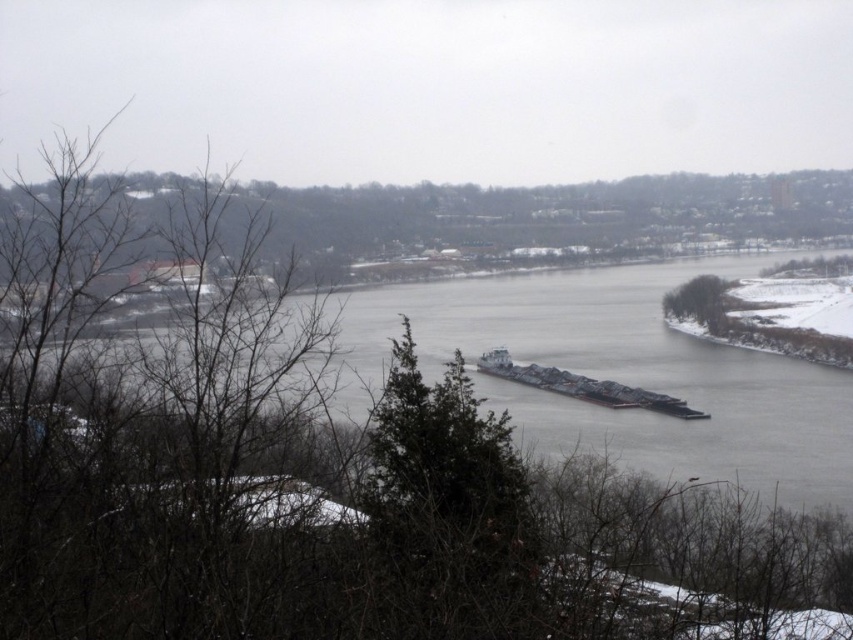
Looking at this image, can you confirm if dark gray metallic barge at center is taller than green leafy tree at right?

Indeed, dark gray metallic barge at center has a greater height compared to green leafy tree at right.

Who is positioned more to the right, dark gray metallic barge at center or green leafy tree at right?

From the viewer's perspective, green leafy tree at right appears more on the right side.

Describe the element at coordinates (583, 387) in the screenshot. I see `dark gray metallic barge at center` at that location.

You are a GUI agent. You are given a task and a screenshot of the screen. Output one action in this format:
    pyautogui.click(x=<x>, y=<y>)
    Task: Click on the dark gray metallic barge at center
    The height and width of the screenshot is (640, 853).
    Given the screenshot: What is the action you would take?
    pyautogui.click(x=583, y=387)